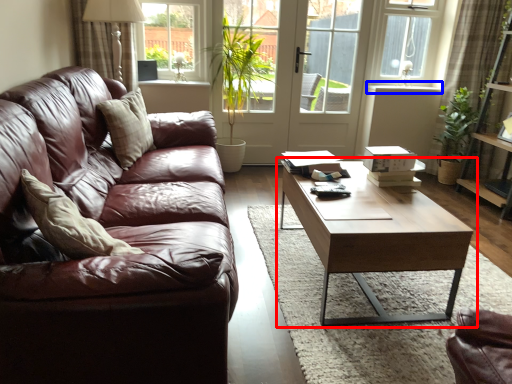
Question: Which of the following is the closest to the observer, coffee table (highlighted by a red box) or window sill (highlighted by a blue box)?

Choices:
 (A) coffee table
 (B) window sill

Answer: (A)